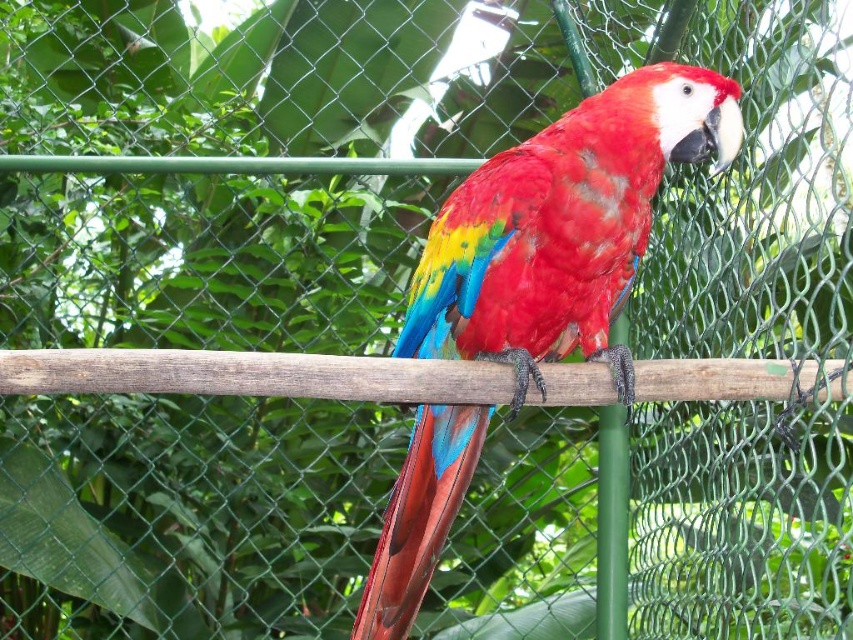
Question: In this image, where is shiny red parrot at center located relative to wooden pole at center?

Choices:
 (A) below
 (B) above

Answer: (B)

Question: Which point is farther to the camera?

Choices:
 (A) shiny red parrot at center
 (B) wooden pole at center

Answer: (A)

Question: Can you confirm if shiny red parrot at center is positioned to the right of wooden pole at center?

Choices:
 (A) no
 (B) yes

Answer: (B)

Question: Among these objects, which one is farthest from the camera?

Choices:
 (A) shiny red parrot at center
 (B) wooden pole at center

Answer: (A)

Question: Does shiny red parrot at center appear on the left side of wooden pole at center?

Choices:
 (A) yes
 (B) no

Answer: (B)